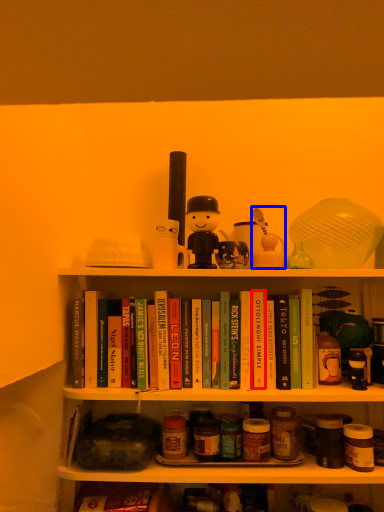
Question: Which point is closer to the camera, paperback book (highlighted by a red box) or toy (highlighted by a blue box)?

Choices:
 (A) paperback book
 (B) toy

Answer: (A)